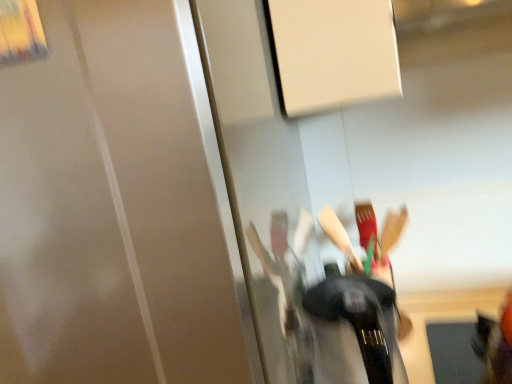
What do you see at coordinates (117, 207) in the screenshot? The image size is (512, 384). I see `transparent glass door at right` at bounding box center [117, 207].

Image resolution: width=512 pixels, height=384 pixels. I want to click on transparent glass door at right, so click(x=117, y=207).

At what (x,y) coordinates should I click in order to perform the action: click on transparent glass door at right. Please return your answer as a coordinate pair (x, y). Looking at the image, I should click on (117, 207).